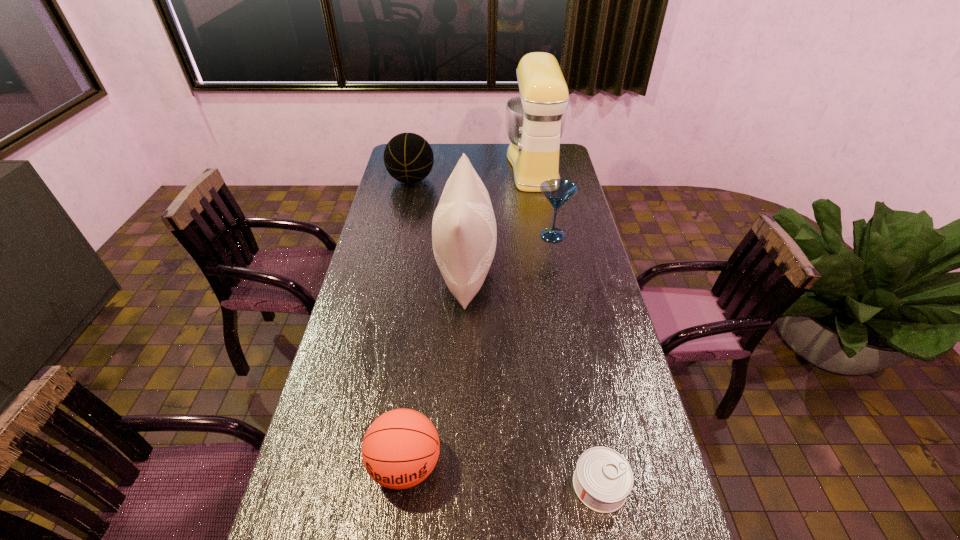
Where is `vacant space located on the front side of the cushion`? This screenshot has width=960, height=540. vacant space located on the front side of the cushion is located at coordinates (551, 271).

Find the location of a particular element. The width and height of the screenshot is (960, 540). vacant region located 0.240m on the right of the taller basketball is located at coordinates (487, 180).

You are a GUI agent. You are given a task and a screenshot of the screen. Output one action in this format:
    pyautogui.click(x=<x>, y=<y>)
    Task: Click on the vacant position located 0.100m on the front of the martini
    This screenshot has height=540, width=960.
    Given the screenshot: What is the action you would take?
    [558, 264]

At what (x,y) coordinates should I click in order to perform the action: click on free space located on the side with logo of the nearer basketball. Please return your answer as a coordinate pair (x, y). Looking at the image, I should click on (397, 531).

At what (x,y) coordinates should I click in order to perform the action: click on vacant space located on the left of the can. Please return your answer as a coordinate pair (x, y). Looking at the image, I should click on pyautogui.click(x=450, y=485).

The image size is (960, 540). Find the location of `object located in the far edge section of the desktop`. object located in the far edge section of the desktop is located at coordinates (535, 120).

Identify the location of object at the left edge. The image size is (960, 540). (408, 157).

This screenshot has height=540, width=960. In order to click on mixer that is at the right edge in this screenshot , I will do `click(535, 120)`.

At what (x,y) coordinates should I click in order to perform the action: click on martini present at the right edge. Please return your answer as a coordinate pair (x, y). Looking at the image, I should click on (557, 191).

Image resolution: width=960 pixels, height=540 pixels. What are the coordinates of `can at the right edge` in the screenshot? It's located at (603, 479).